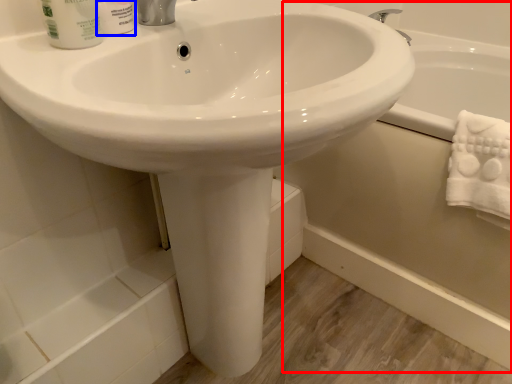
Question: Which object appears farthest to the camera in this image, bath (highlighted by a red box) or shaving cream (highlighted by a blue box)?

Choices:
 (A) bath
 (B) shaving cream

Answer: (A)